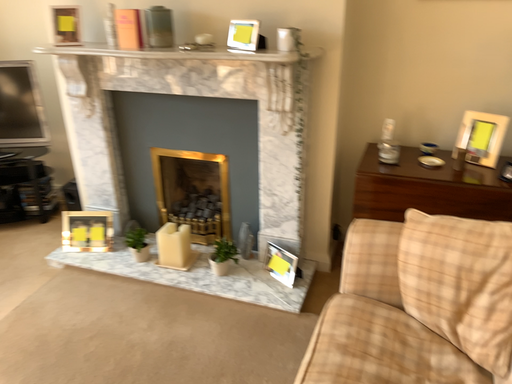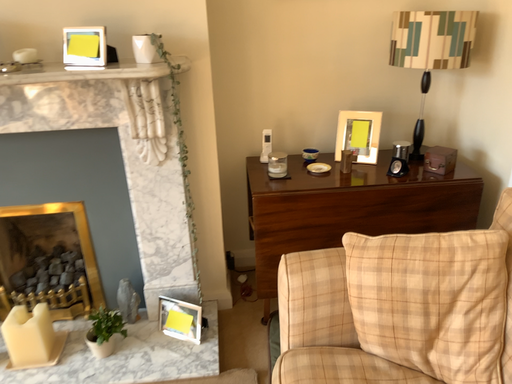
Question: Which way did the camera rotate in the video?

Choices:
 (A) rotated left
 (B) rotated right

Answer: (B)